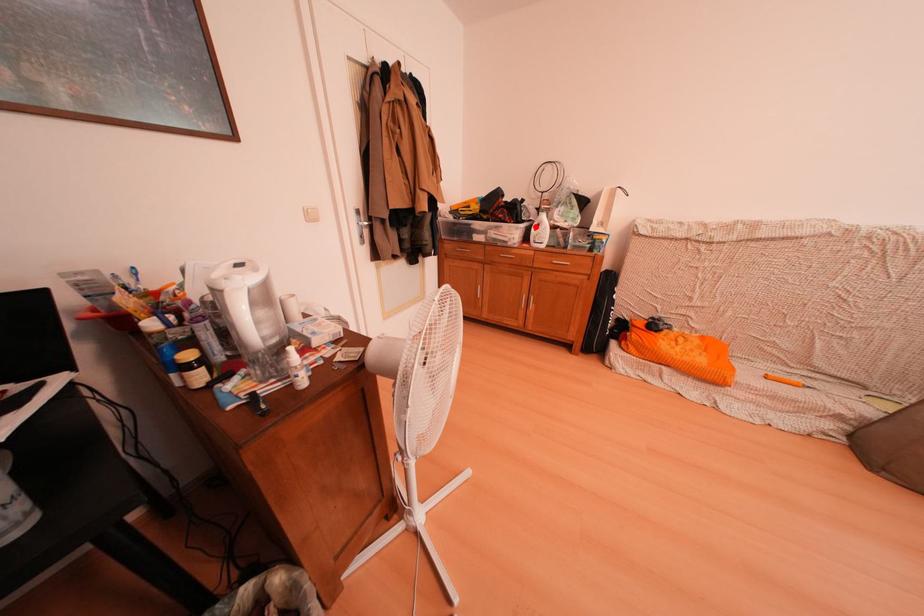
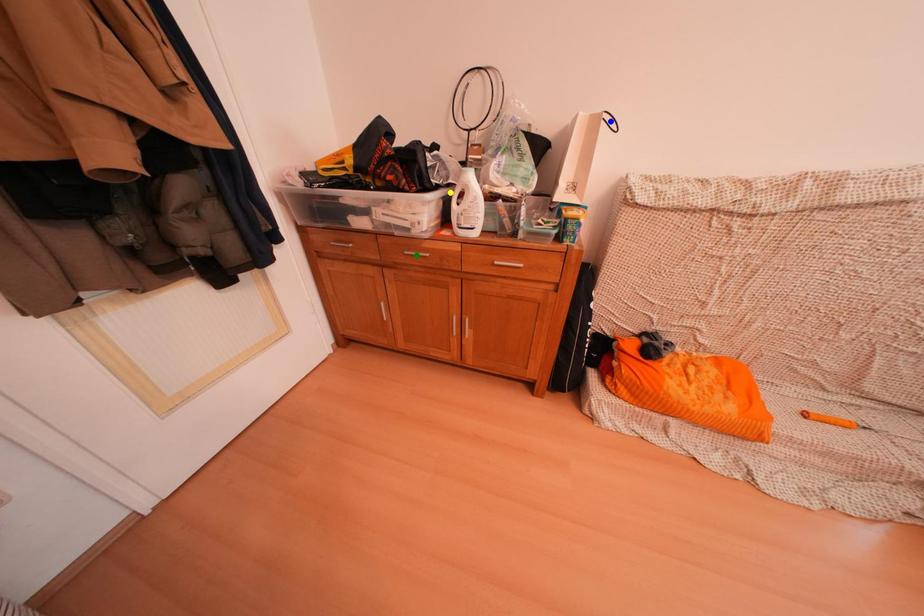
Question: I am providing you with two images of the same scene from different viewpoints. A red point is marked on the first image. You are given multiple points on the second image. Which mark in image 2 goes with the point in image 1?

Choices:
 (A) blue point
 (B) yellow point
 (C) green point

Answer: (B)